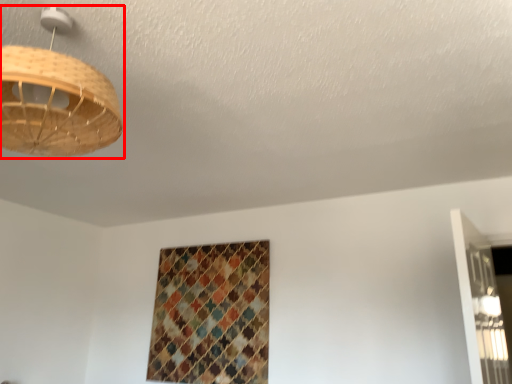
Question: From the image's perspective, what is the correct spatial positioning of lamp (annotated by the red box) in reference to pattern?

Choices:
 (A) below
 (B) above

Answer: (B)